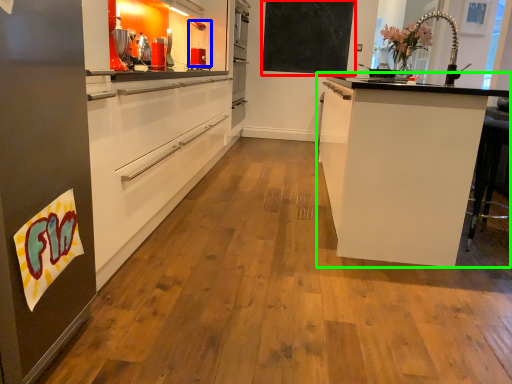
Question: Which object is the farthest from bulletin board (highlighted by a red box)? Choose among these: kitchen appliance (highlighted by a blue box) or cabinetry (highlighted by a green box).

Choices:
 (A) kitchen appliance
 (B) cabinetry

Answer: (B)